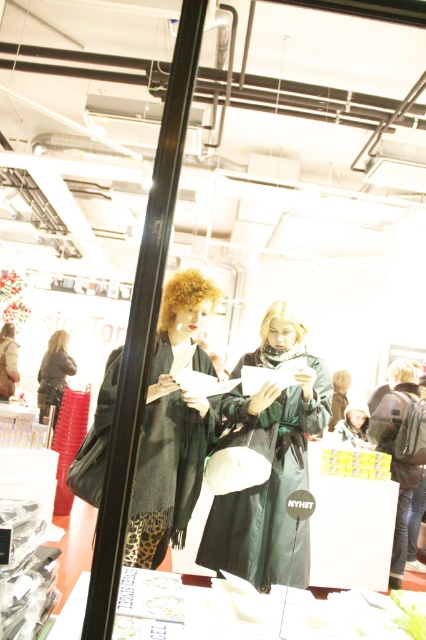
Question: Does green matte coat at center appear under leather jacket at left?

Choices:
 (A) no
 (B) yes

Answer: (A)

Question: Does green wool scarf at center appear under leather jacket at left?

Choices:
 (A) no
 (B) yes

Answer: (A)

Question: Which of these objects is positioned closest to the green matte coat at center?

Choices:
 (A) leather jacket at left
 (B) green wool scarf at center

Answer: (B)

Question: Which object is the farthest from the green matte coat at center?

Choices:
 (A) green wool scarf at center
 (B) leather jacket at left

Answer: (B)

Question: Considering the relative positions of green matte coat at center and leather jacket at left in the image provided, where is green matte coat at center located with respect to leather jacket at left?

Choices:
 (A) right
 (B) left

Answer: (A)

Question: Which of the following is the closest to the observer?

Choices:
 (A) (187, 476)
 (B) (45, 392)
 (C) (278, 513)

Answer: (C)